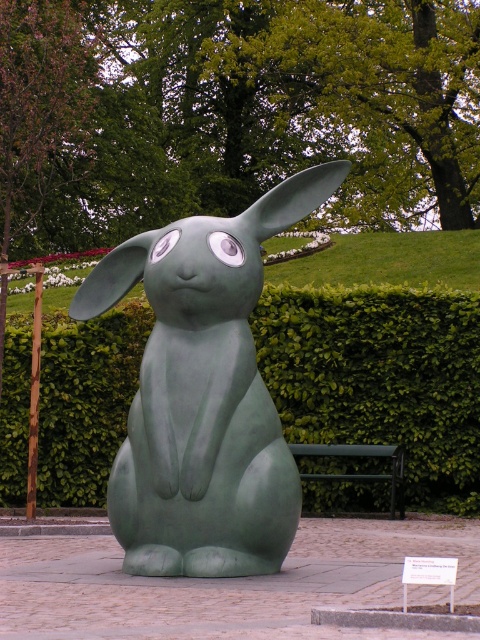
You are standing 3 meters away from the green matte rabbit at center. If you walk directly towards the green leafy hedge at center, how far will you have to walk to reach it?

The green leafy hedge at center is 6.25 meters away from the green matte rabbit at center. Since you are currently 3 meters away from the green matte rabbit at center, you will need to walk an additional 3.25 meters to reach the green leafy hedge at center.

You are standing at the point marked by the coordinates point (204, 394) in the park. Looking around, you see the green matte rabbit at center. Which direction should you walk to reach the grassy hill with white flowers?

The grassy hill with white flowers is located behind the green matte rabbit at center. Since you are at point (204, 394), which corresponds to the green matte rabbit at center, you should walk forward to reach the grassy hill with white flowers.

You are a park visitor who wants to sit on the green metal bench at center. The green leafy hedge at center is blocking your path. Can you walk around it easily?

The green leafy hedge at center is 32.73 inches from green metal bench at center. Since the distance between them is narrow, you might have difficulty walking around the hedge to reach the bench easily.